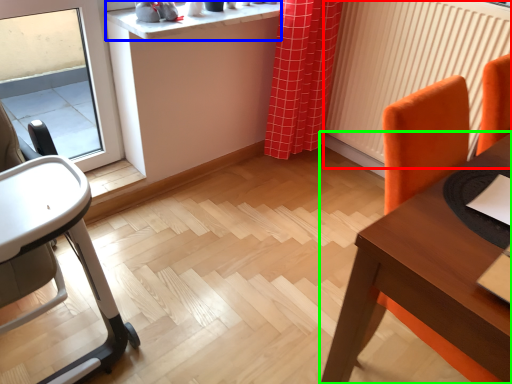
Question: Which is nearer to the radiator (highlighted by a red box)? counter top (highlighted by a blue box) or table (highlighted by a green box).

Choices:
 (A) counter top
 (B) table

Answer: (A)